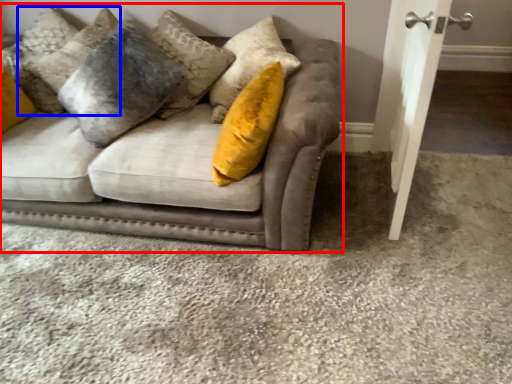
Question: Which point is closer to the camera, studio couch (highlighted by a red box) or pillow (highlighted by a blue box)?

Choices:
 (A) studio couch
 (B) pillow

Answer: (A)